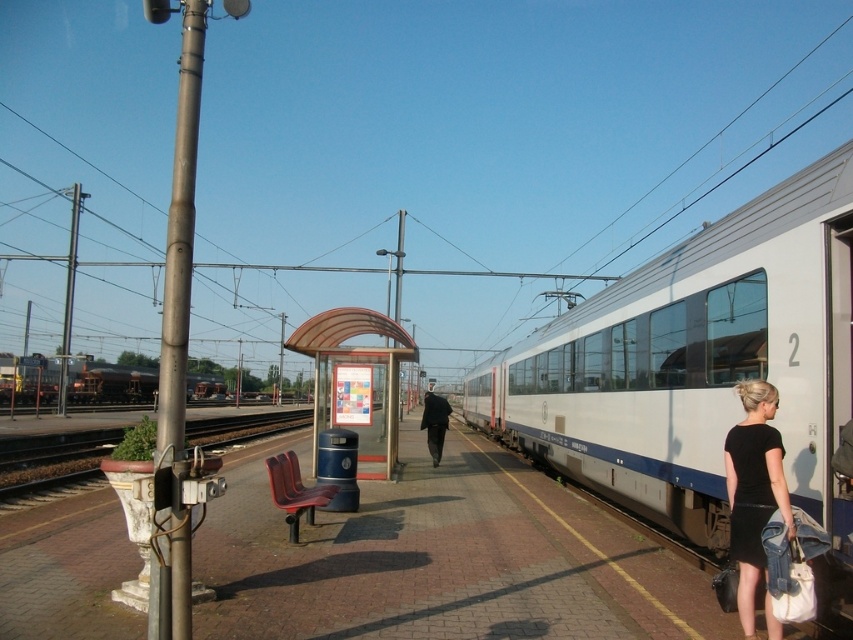
You are a passenger at the train station and want to place a 2.5 meter long luggage cart between the black matte dress at lower right and the brown wooden train track at lower left. Can the cart fit between them?

The black matte dress at lower right is narrower than the brown wooden train track at lower left. However, the distance between them isn

You are standing at the entrance of the train station and want to sit down. There is a red plastic bench at center. Based on its coordinates, is the bench closer to the waiting area or the left side of the platform?

The red plastic bench at center is located at point [363,365], which is closer to the waiting area than the left side of the platform.